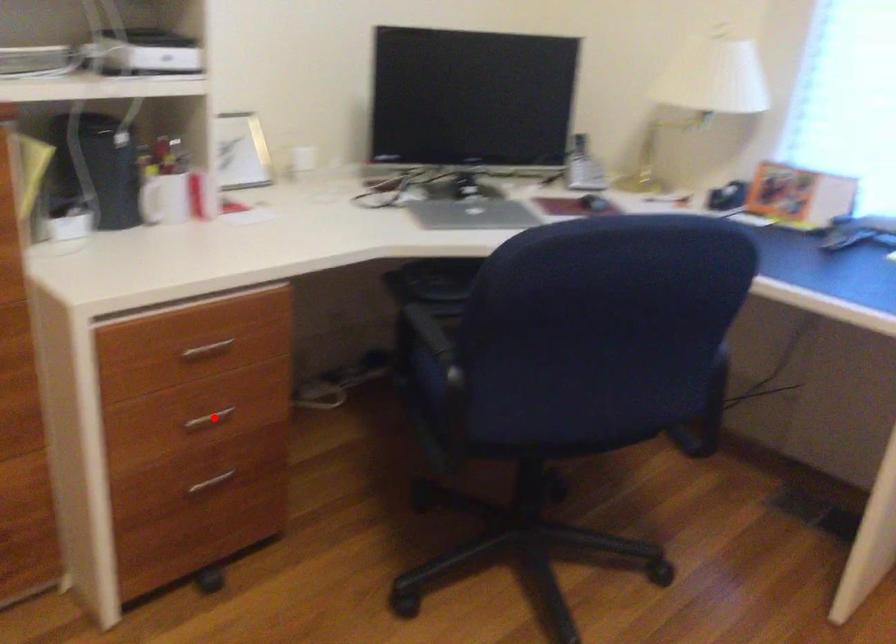
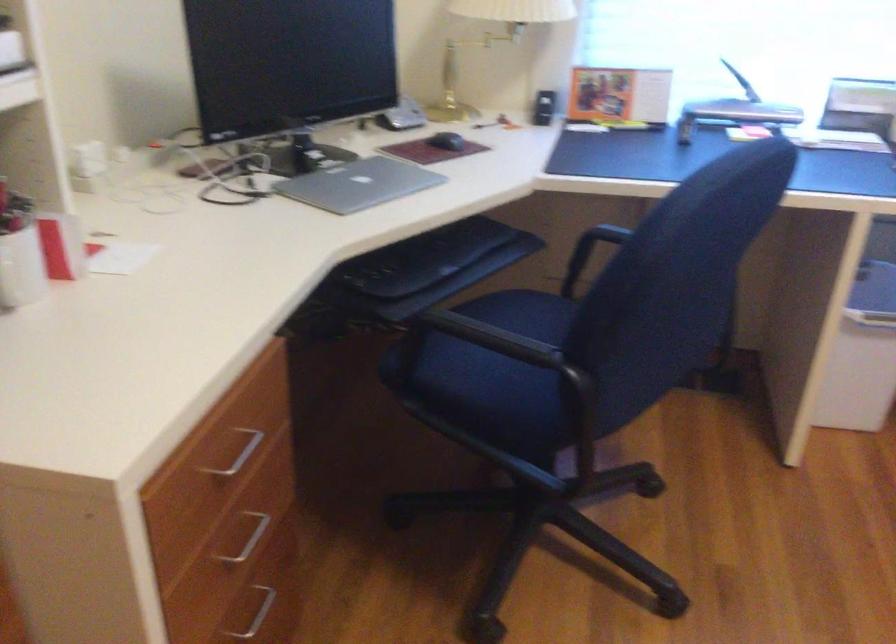
Question: I am providing you with two images of the same scene from different viewpoints. Image1 has a red point marked. In image2, the corresponding 3D location appears at what relative position? Reply with the corresponding letter.

Choices:
 (A) Closer
 (B) Farther

Answer: (A)